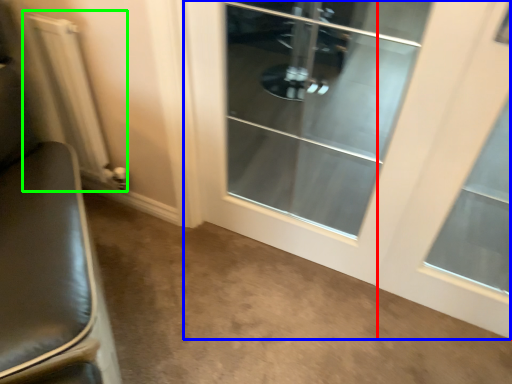
Question: Which object is positioned farthest from window (highlighted by a red box)? Select from door (highlighted by a blue box) and radiator (highlighted by a green box).

Choices:
 (A) door
 (B) radiator

Answer: (B)